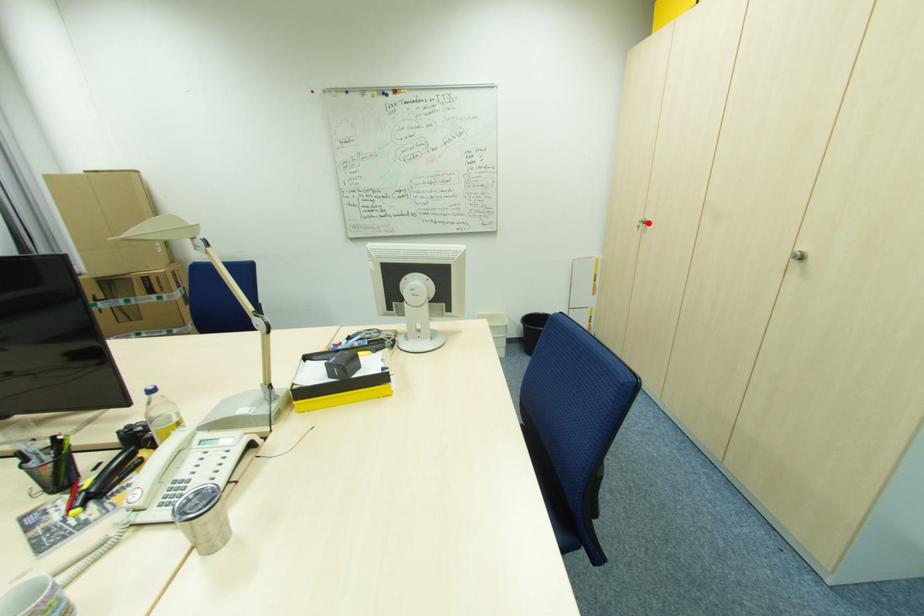
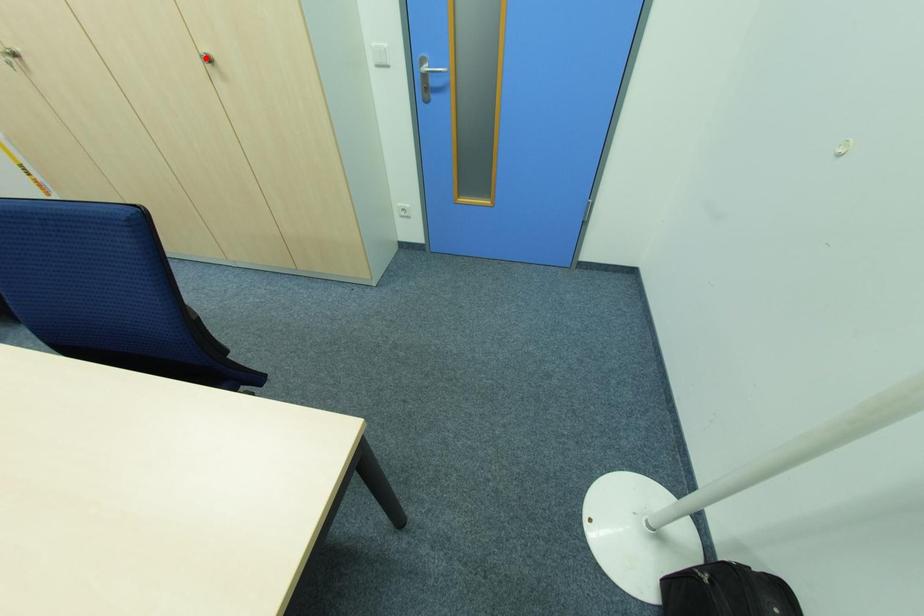
I am providing you with two images of the same scene from different viewpoints. A red point is marked on the first image and another point is marked on the second image. Do the highlighted points in image1 and image2 indicate the same real-world spot?

No